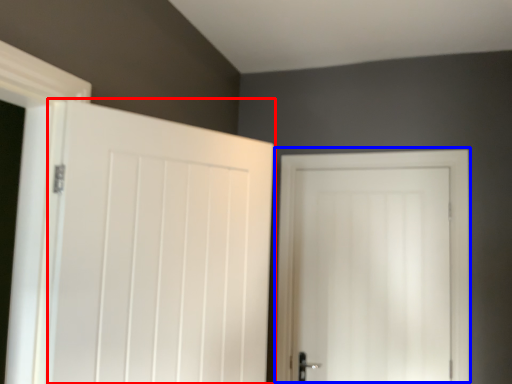
Question: Among these objects, which one is nearest to the camera, door (highlighted by a red box) or door (highlighted by a blue box)?

Choices:
 (A) door
 (B) door

Answer: (A)